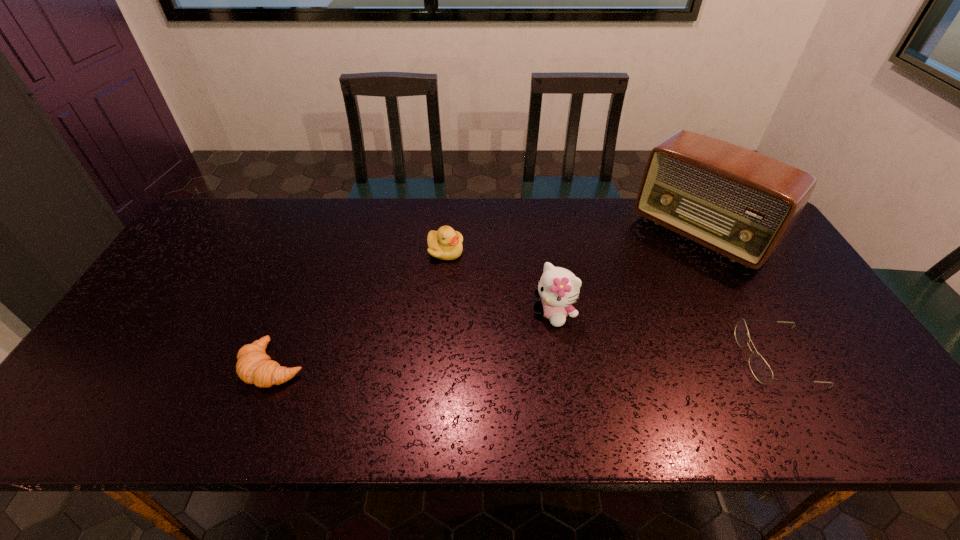
The height and width of the screenshot is (540, 960). I want to click on blank space at the left edge, so click(x=184, y=318).

In the image, there is a desktop. Identify the location of free space at the right edge. This screenshot has width=960, height=540. (777, 329).

I want to click on blank space at the near right corner of the desktop, so click(x=836, y=389).

The height and width of the screenshot is (540, 960). Identify the location of vacant space that's between the spectacles and the leftmost object. [x=525, y=361].

This screenshot has width=960, height=540. I want to click on vacant region between the second tallest object and the spectacles, so click(x=665, y=335).

Find the location of a particular element. Image resolution: width=960 pixels, height=540 pixels. unoccupied position between the radio receiver and the third object from left to right is located at coordinates [627, 274].

Where is `vacant area that lies between the radio receiver and the third shortest object`? vacant area that lies between the radio receiver and the third shortest object is located at coordinates (573, 242).

At what (x,y) coordinates should I click in order to perform the action: click on free space between the tallest object and the duckling. Please return your answer as a coordinate pair (x, y). Looking at the image, I should click on (573, 242).

Locate an element on the screen. This screenshot has width=960, height=540. free space between the leftmost object and the radio receiver is located at coordinates (487, 300).

Image resolution: width=960 pixels, height=540 pixels. I want to click on vacant point located between the tallest object and the spectacles, so click(738, 295).